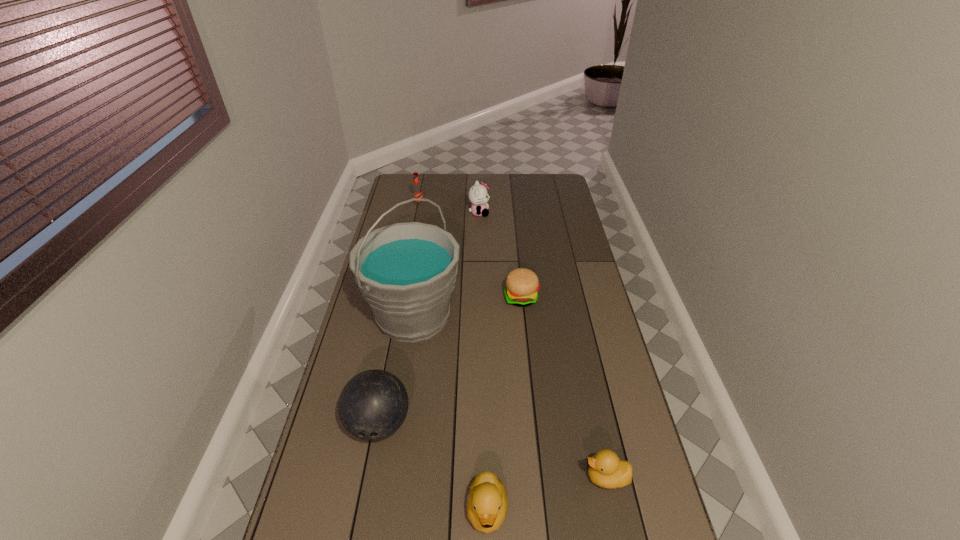
This screenshot has width=960, height=540. I want to click on vacant area that lies between the shorter duckling and the fifth farthest object, so click(492, 450).

This screenshot has height=540, width=960. In order to click on object that is the third closest to the left duckling in this screenshot , I will do `click(406, 272)`.

Image resolution: width=960 pixels, height=540 pixels. What are the coordinates of `the closest object relative to the third nearest object` in the screenshot? It's located at click(x=406, y=272).

I want to click on free spot that satisfies the following two spatial constraints: 1. on the front-facing side of the kitten; 2. on the left side of the sixth object from left to right, so click(479, 298).

This screenshot has width=960, height=540. Find the location of `blank area in the image that satisfies the following two spatial constraints: 1. on the front side of the hamburger; 2. on the right side of the root beer`. blank area in the image that satisfies the following two spatial constraints: 1. on the front side of the hamburger; 2. on the right side of the root beer is located at coordinates (401, 298).